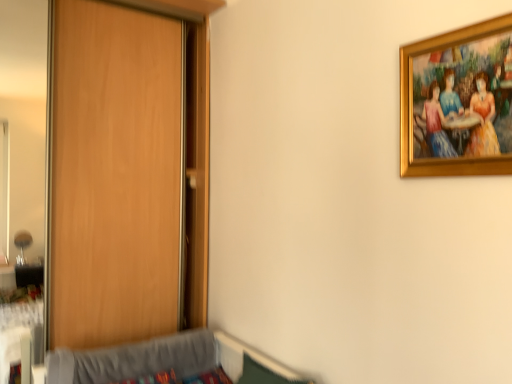
Question: Considering the relative sizes of gold-framed painting at upper right and wooden door at left in the image provided, is gold-framed painting at upper right bigger than wooden door at left?

Choices:
 (A) yes
 (B) no

Answer: (B)

Question: Is gold-framed painting at upper right to the left of wooden door at left from the viewer's perspective?

Choices:
 (A) yes
 (B) no

Answer: (B)

Question: From the image's perspective, would you say gold-framed painting at upper right is positioned over wooden door at left?

Choices:
 (A) yes
 (B) no

Answer: (A)

Question: Is gold-framed painting at upper right positioned with its back to wooden door at left?

Choices:
 (A) yes
 (B) no

Answer: (B)

Question: Is gold-framed painting at upper right shorter than wooden door at left?

Choices:
 (A) yes
 (B) no

Answer: (A)

Question: Looking at the image, does gray fabric hospital bed at lower left seem bigger or smaller compared to wooden door at left?

Choices:
 (A) small
 (B) big

Answer: (A)

Question: From the image's perspective, is gray fabric hospital bed at lower left above or below wooden door at left?

Choices:
 (A) above
 (B) below

Answer: (B)

Question: From a real-world perspective, relative to wooden door at left, is gray fabric hospital bed at lower left vertically above or below?

Choices:
 (A) above
 (B) below

Answer: (B)

Question: Is gray fabric hospital bed at lower left wider or thinner than wooden door at left?

Choices:
 (A) wide
 (B) thin

Answer: (A)

Question: Is gold-framed painting at upper right in front of or behind gray fabric hospital bed at lower left in the image?

Choices:
 (A) behind
 (B) front

Answer: (B)

Question: Do you think gold-framed painting at upper right is within gray fabric hospital bed at lower left, or outside of it?

Choices:
 (A) outside
 (B) inside

Answer: (A)

Question: Is point (428, 158) closer or farther from the camera than point (242, 342)?

Choices:
 (A) closer
 (B) farther

Answer: (A)

Question: Is gold-framed painting at upper right taller or shorter than gray fabric hospital bed at lower left?

Choices:
 (A) tall
 (B) short

Answer: (A)

Question: Is wooden door at left in front of or behind gray fabric hospital bed at lower left in the image?

Choices:
 (A) behind
 (B) front

Answer: (A)

Question: From the image's perspective, is wooden door at left above or below gray fabric hospital bed at lower left?

Choices:
 (A) above
 (B) below

Answer: (A)